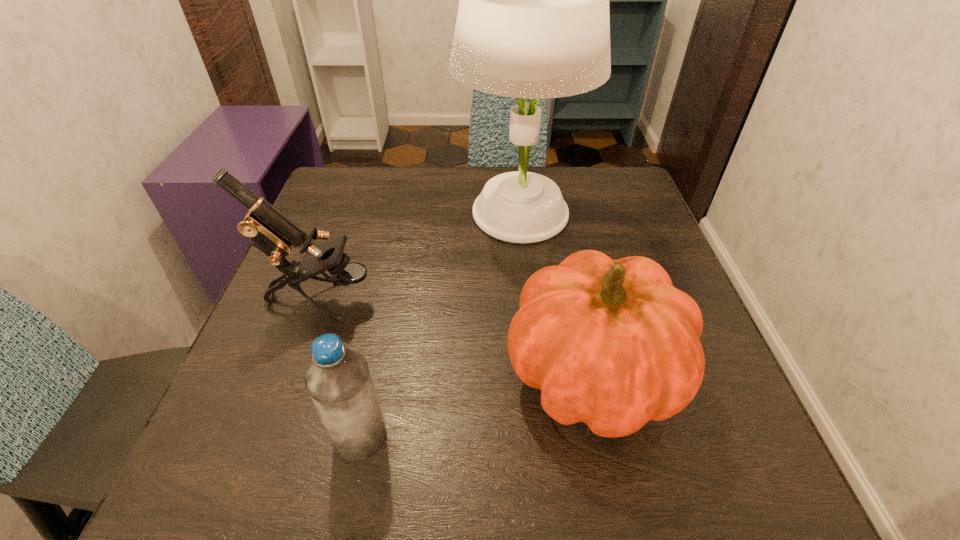
Identify the location of free space that satisfies the following two spatial constraints: 1. through the eyepiece of the microscope; 2. on the right side of the water bottle. (273, 437).

Find the location of a particular element. vacant space that satisfies the following two spatial constraints: 1. on the front-facing side of the lamp; 2. on the right side of the pumpkin is located at coordinates (536, 374).

Locate an element on the screen. The image size is (960, 540). blank area in the image that satisfies the following two spatial constraints: 1. on the front-facing side of the farthest object; 2. on the left side of the pumpkin is located at coordinates (536, 374).